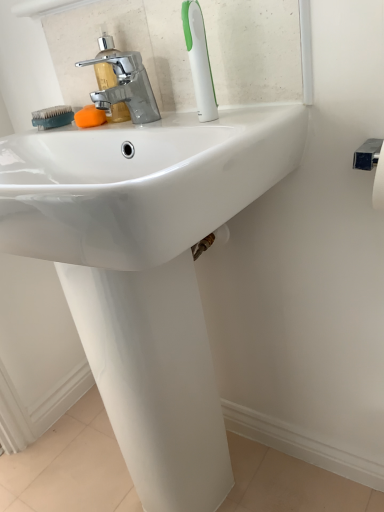
Where is `vacant area in front of teal rubber brush at left`? vacant area in front of teal rubber brush at left is located at coordinates (x=79, y=128).